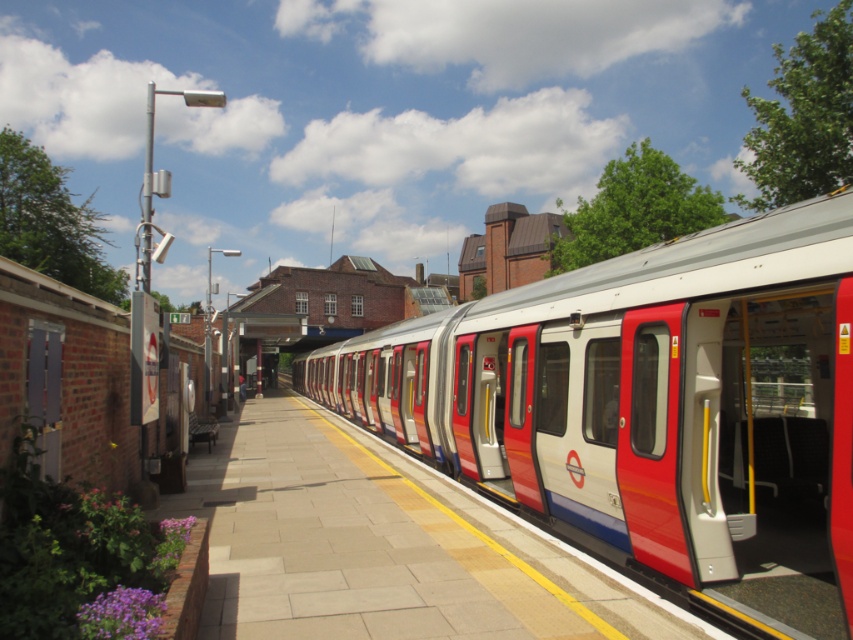
You are a passenger waiting at the train station. You see the silver metallic train at center and the smooth concrete platform at center. Which object is closer to the edge of the platform?

The silver metallic train at center is closer to the edge of the platform because it is positioned to the right of the smooth concrete platform at center, which is the edge closest to the train.